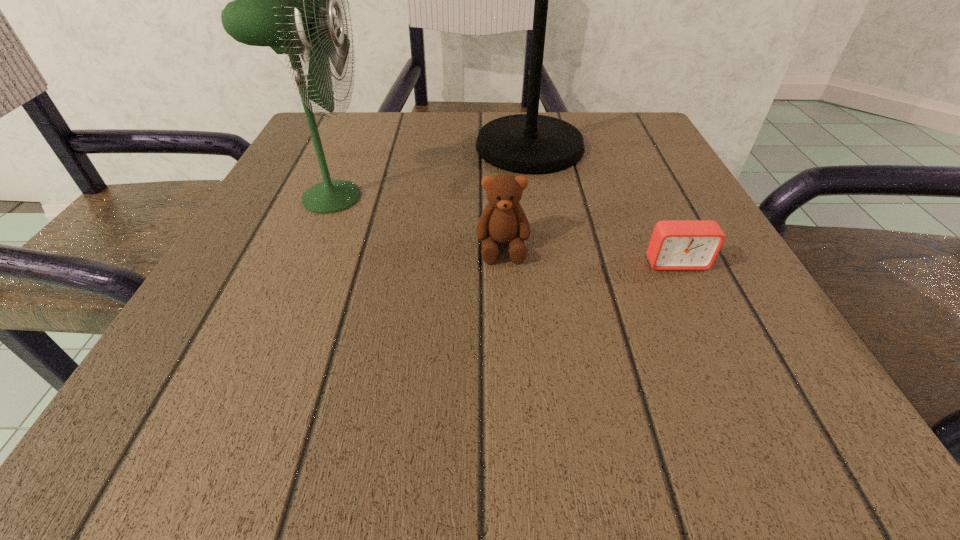
Where is `free space between the tallest object and the third shortest object`? free space between the tallest object and the third shortest object is located at coordinates (430, 172).

At what (x,y) coordinates should I click in order to perform the action: click on object identified as the third closest to the fan. Please return your answer as a coordinate pair (x, y). Looking at the image, I should click on (675, 244).

Identify which object is the third nearest to the second shortest object. Please provide its 2D coordinates. Your answer should be formatted as a tuple, i.e. [(x, y)], where the tuple contains the x and y coordinates of a point satisfying the conditions above.

[(283, 0)]